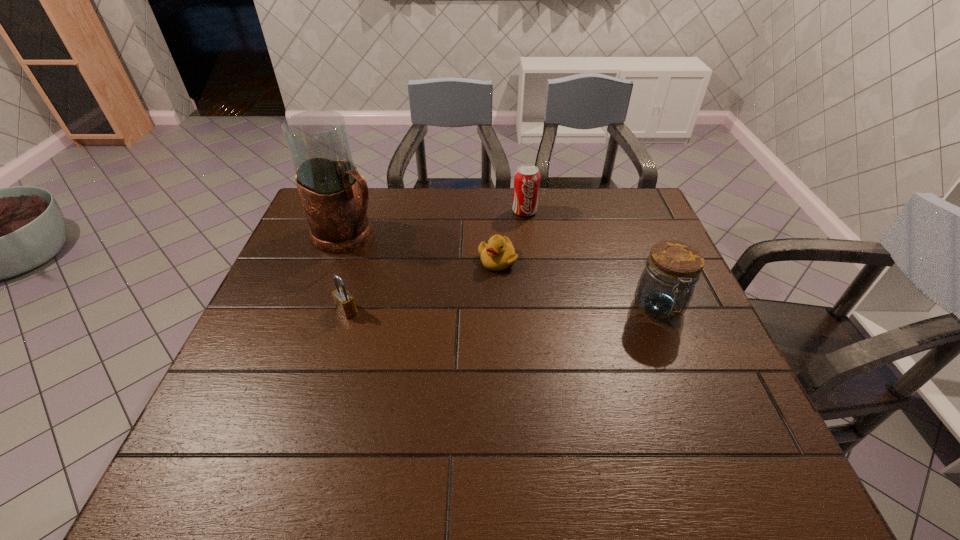
Where is `object at the left edge`? Image resolution: width=960 pixels, height=540 pixels. object at the left edge is located at coordinates (335, 197).

The width and height of the screenshot is (960, 540). In order to click on object that is at the right edge in this screenshot , I will do `click(665, 288)`.

I want to click on object at the far left corner, so click(x=335, y=197).

Find the location of `vacant space at the far edge of the desktop`. vacant space at the far edge of the desktop is located at coordinates tap(582, 193).

Image resolution: width=960 pixels, height=540 pixels. Identify the location of vacant space at the near edge of the desktop. (355, 416).

This screenshot has height=540, width=960. In the image, there is a desktop. In order to click on free region at the left edge in this screenshot , I will do `click(255, 386)`.

Find the location of a particular element. Image resolution: width=960 pixels, height=540 pixels. vacant area at the near left corner of the desktop is located at coordinates (220, 417).

Locate an element on the screen. The width and height of the screenshot is (960, 540). free point at the far right corner is located at coordinates pyautogui.click(x=655, y=221).

Where is `vacant space at the near right corner of the desktop`? This screenshot has height=540, width=960. vacant space at the near right corner of the desktop is located at coordinates (672, 409).

This screenshot has height=540, width=960. Find the location of `vacant point located between the pitcher and the jar`. vacant point located between the pitcher and the jar is located at coordinates point(503,272).